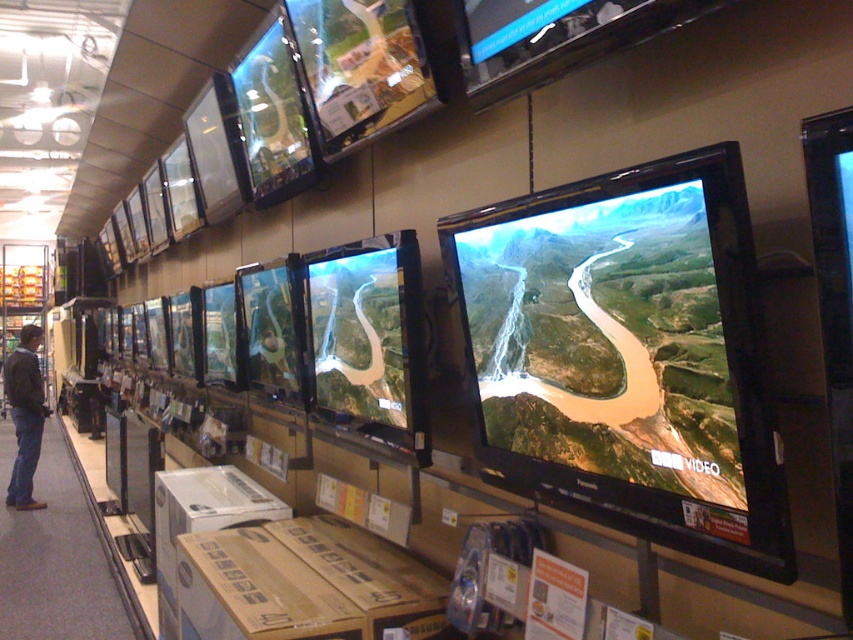
Question: Which point is farther from the camera taking this photo?

Choices:
 (A) [x=36, y=380]
 (B) [x=445, y=237]

Answer: (A)

Question: Can you confirm if satin black flat screen at center is thinner than dark gray jacket at left?

Choices:
 (A) yes
 (B) no

Answer: (A)

Question: Is satin black flat screen at center above dark gray jacket at left?

Choices:
 (A) no
 (B) yes

Answer: (B)

Question: Among these points, which one is farthest from the camera?

Choices:
 (A) (38, 380)
 (B) (741, 408)

Answer: (A)

Question: Does satin black flat screen at center appear on the left side of dark gray jacket at left?

Choices:
 (A) yes
 (B) no

Answer: (B)

Question: Which point appears farthest from the camera in this image?

Choices:
 (A) (27, 353)
 (B) (606, 502)

Answer: (A)